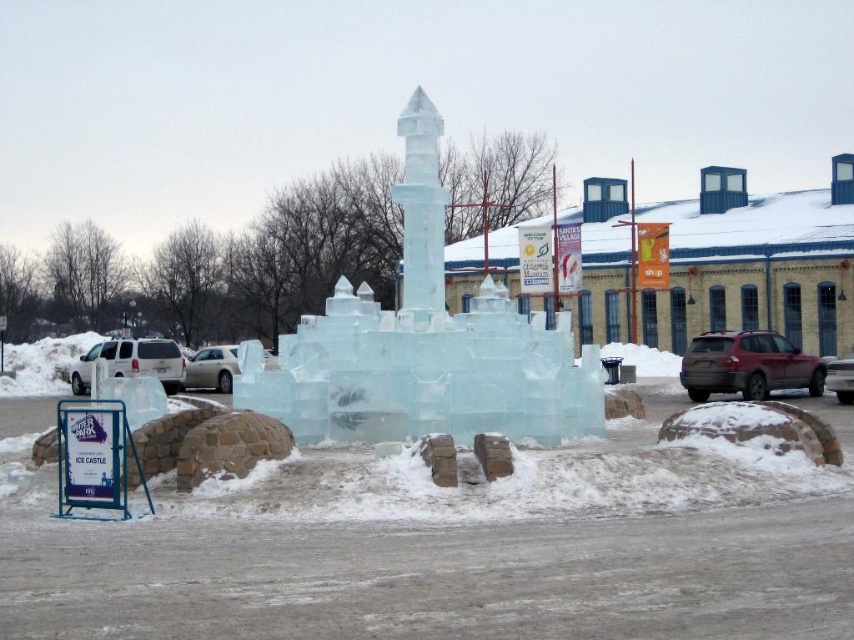
You are a photographer planning to take a photo of the ice sculpture. You have two SUVs in the frame, the matte gray suv at right and the metallic silver suv at center. Which SUV should you position closer to the camera to ensure the ice sculpture remains the main focus without being blocked?

The metallic silver suv at center should be positioned closer to the camera because the matte gray suv at right is much taller and might block the view of the ice sculpture if placed too close.

You are a photographer wanting to capture both the white matte suv at left and the white matte car at center in a single frame. Based on their positions, which vehicle should you focus on first to ensure both are in the shot?

The white matte car at center is behind the white matte suv at left, so you should focus on the white matte suv at left first to ensure both are in the frame.